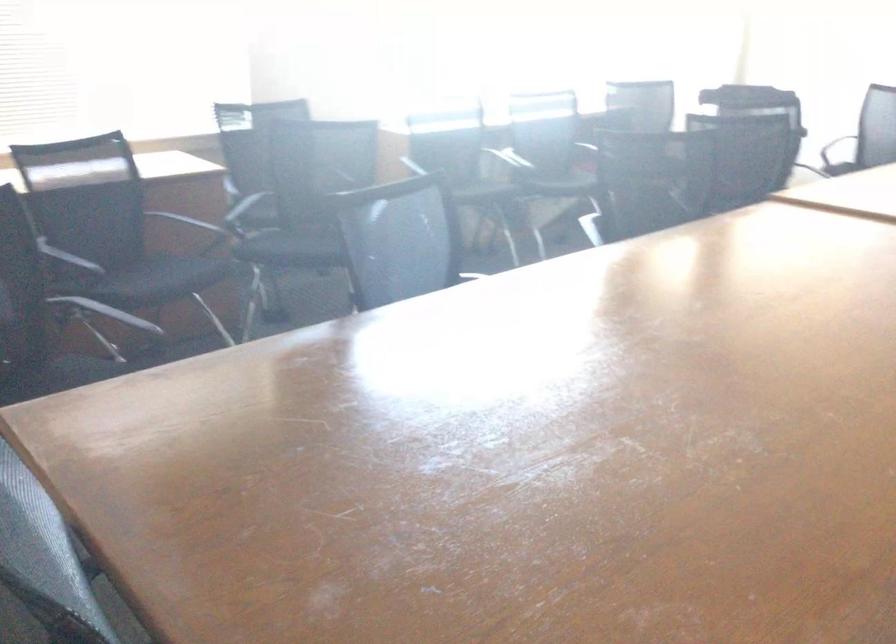
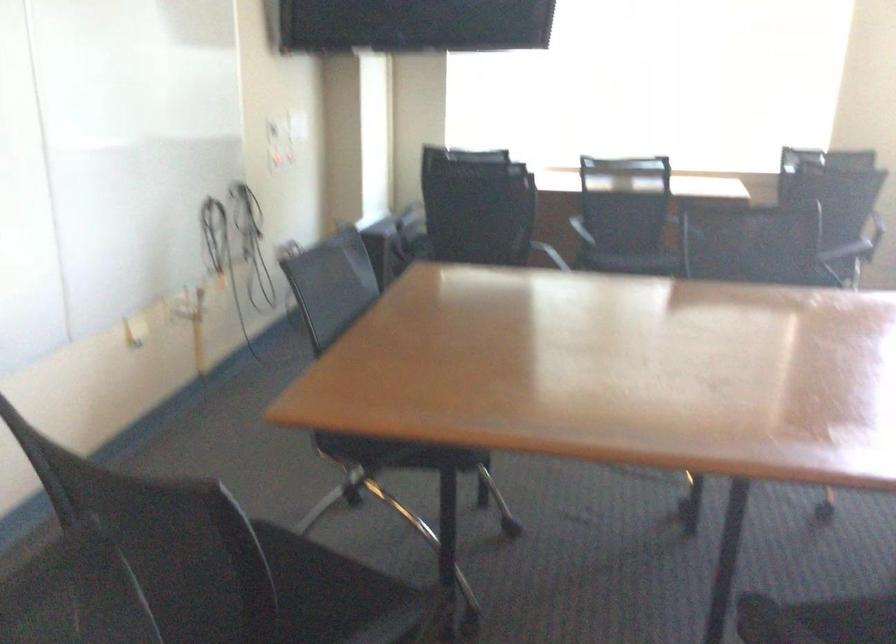
The point at [153,285] is marked in the first image. Where is the corresponding point in the second image?

(633, 260)